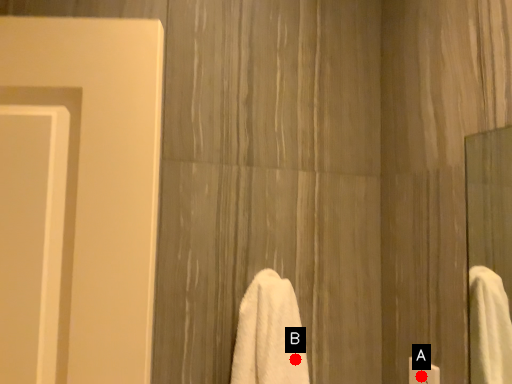
Question: Two points are circled on the image, labeled by A and B beside each circle. Which point is farther from the camera taking this photo?

Choices:
 (A) A is further
 (B) B is further

Answer: (A)